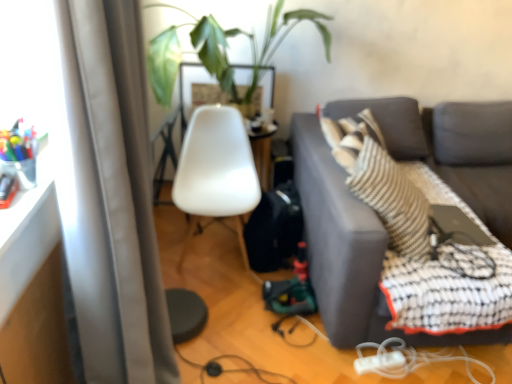
Question: From the image's perspective, is black rubber cable at lower center, arranged as the 2th cable when viewed from the right, on top of satin gray curtain at left?

Choices:
 (A) yes
 (B) no

Answer: (B)

Question: Is black rubber cable at lower center, which appears as the 1th cable when viewed from the left, directly adjacent to satin gray curtain at left?

Choices:
 (A) yes
 (B) no

Answer: (B)

Question: Is black rubber cable at lower center, which appears as the 1th cable when viewed from the left, facing away from satin gray curtain at left?

Choices:
 (A) yes
 (B) no

Answer: (B)

Question: Considering the relative sizes of black rubber cable at lower center, which appears as the 1th cable when viewed from the left, and satin gray curtain at left in the image provided, is black rubber cable at lower center, which appears as the 1th cable when viewed from the left, bigger than satin gray curtain at left?

Choices:
 (A) yes
 (B) no

Answer: (B)

Question: Can you confirm if black rubber cable at lower center, arranged as the 2th cable when viewed from the right, is taller than satin gray curtain at left?

Choices:
 (A) no
 (B) yes

Answer: (A)

Question: Considering their positions, is black rubber cable at lower center, arranged as the 2th cable when viewed from the right, located in front of or behind white plastic extension cord at lower center?

Choices:
 (A) behind
 (B) front

Answer: (B)

Question: From the image's perspective, relative to white plastic extension cord at lower center, is black rubber cable at lower center, which appears as the 1th cable when viewed from the left, above or below?

Choices:
 (A) above
 (B) below

Answer: (B)

Question: In terms of size, does black rubber cable at lower center, arranged as the 2th cable when viewed from the right, appear bigger or smaller than white plastic extension cord at lower center?

Choices:
 (A) big
 (B) small

Answer: (A)

Question: Considering the positions of point [260, 380] and point [387, 360], is point [260, 380] closer or farther from the camera than point [387, 360]?

Choices:
 (A) closer
 (B) farther

Answer: (A)

Question: From their relative heights in the image, would you say white plastic extension cord at lower center is taller or shorter than dark gray fabric couch at right?

Choices:
 (A) short
 (B) tall

Answer: (A)

Question: Does point (356, 362) appear closer or farther from the camera than point (422, 112)?

Choices:
 (A) farther
 (B) closer

Answer: (B)

Question: Choose the correct answer: Is white plastic extension cord at lower center inside dark gray fabric couch at right or outside it?

Choices:
 (A) inside
 (B) outside

Answer: (A)

Question: Looking at their shapes, would you say white plastic extension cord at lower center is wider or thinner than dark gray fabric couch at right?

Choices:
 (A) thin
 (B) wide

Answer: (A)

Question: Would you say green leafy plant at upper center is to the left or to the right of black rubber cable at lower center, which appears as the 1th cable when viewed from the left, in the picture?

Choices:
 (A) right
 (B) left

Answer: (A)

Question: Does point (212, 56) appear closer or farther from the camera than point (179, 354)?

Choices:
 (A) closer
 (B) farther

Answer: (B)